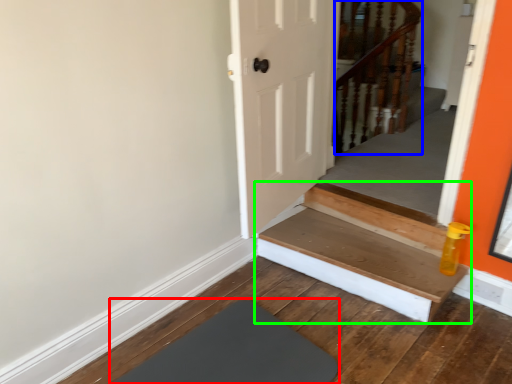
Question: Considering the real-world distances, which object is closest to mat (highlighted by a red box)? rail (highlighted by a blue box) or stairs (highlighted by a green box).

Choices:
 (A) rail
 (B) stairs

Answer: (B)